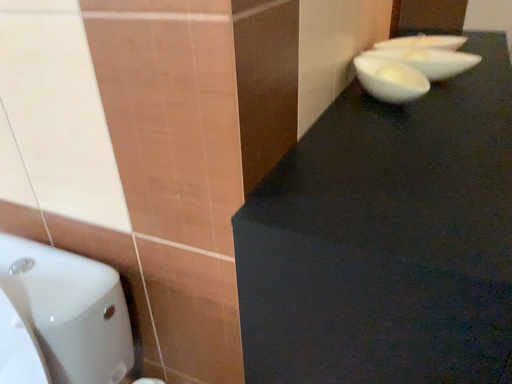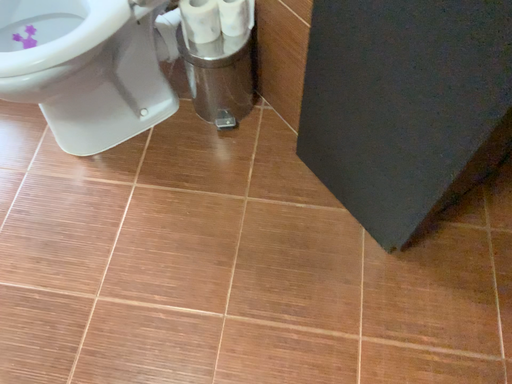
Question: Which way did the camera rotate in the video?

Choices:
 (A) rotated left
 (B) rotated right

Answer: (A)